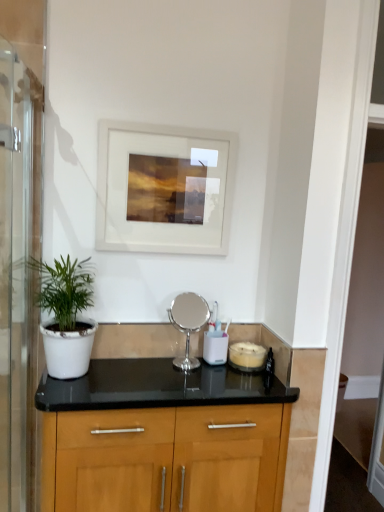
In order to face silver metallic mirror at center, positioned as the 2th appliance in right-to-left order, should I rotate leftwards or rightwards?

Rotate your view left by about 0.871°.

Measure the distance between silver metallic mirror at center, which is the 1th appliance in left-to-right order, and camera.

silver metallic mirror at center, which is the 1th appliance in left-to-right order, is 5.32 feet from camera.

Where is `white matte picture frame at upper center`? white matte picture frame at upper center is located at coordinates (164, 189).

Is point (243, 360) closer or farther from the camera than point (179, 311)?

Point (243, 360) is closer to the camera than point (179, 311).

Find the location of a particular element. This screenshot has width=384, height=512. appliance on the right side of silver metallic mirror at center, which is the 1th appliance in left-to-right order is located at coordinates pyautogui.click(x=247, y=356).

Considering the sizes of white glossy candle at center, placed as the first appliance when sorted from right to left, and silver metallic mirror at center, which is the 1th appliance in left-to-right order, in the image, is white glossy candle at center, placed as the first appliance when sorted from right to left, taller or shorter than silver metallic mirror at center, which is the 1th appliance in left-to-right order,?

In the image, white glossy candle at center, placed as the first appliance when sorted from right to left, appears to be shorter than silver metallic mirror at center, which is the 1th appliance in left-to-right order.

From the image's perspective, is white glossy candle at center, which is counted as the 2th appliance, starting from the left, above silver metallic mirror at center, which is the 1th appliance in left-to-right order?

Actually, white glossy candle at center, which is counted as the 2th appliance, starting from the left, appears below silver metallic mirror at center, which is the 1th appliance in left-to-right order, in the image.

Does white glossy candle at center, placed as the first appliance when sorted from right to left, come in front of white matte pot at left?

No, white glossy candle at center, placed as the first appliance when sorted from right to left, is further to the viewer.

Would you consider white glossy candle at center, placed as the first appliance when sorted from right to left, to be distant from white matte pot at left?

white glossy candle at center, placed as the first appliance when sorted from right to left, is actually quite close to white matte pot at left.

Between white glossy candle at center, which is counted as the 2th appliance, starting from the left, and white matte pot at left, which one has more height?

Standing taller between the two is white matte pot at left.

Is white glossy candle at center, placed as the first appliance when sorted from right to left, at the right side of white matte pot at left?

Yes, white glossy candle at center, placed as the first appliance when sorted from right to left, is to the right of white matte pot at left.

Is silver metallic mirror at center, positioned as the 2th appliance in right-to-left order, spatially inside white matte pot at left, or outside of it?

silver metallic mirror at center, positioned as the 2th appliance in right-to-left order, is spatially situated outside white matte pot at left.

How many degrees apart are the facing directions of silver metallic mirror at center, which is the 1th appliance in left-to-right order, and white matte pot at left?

1.38 degrees.

Considering their positions, is silver metallic mirror at center, which is the 1th appliance in left-to-right order, located in front of or behind white matte pot at left?

In the image, silver metallic mirror at center, which is the 1th appliance in left-to-right order, appears behind white matte pot at left.

Is silver metallic mirror at center, positioned as the 2th appliance in right-to-left order, completely or partially outside of white glossy candle at center, placed as the first appliance when sorted from right to left?

Indeed, silver metallic mirror at center, positioned as the 2th appliance in right-to-left order, is completely outside white glossy candle at center, placed as the first appliance when sorted from right to left.

Considering the sizes of objects silver metallic mirror at center, positioned as the 2th appliance in right-to-left order, and white glossy candle at center, which is counted as the 2th appliance, starting from the left, in the image provided, who is smaller, silver metallic mirror at center, positioned as the 2th appliance in right-to-left order, or white glossy candle at center, which is counted as the 2th appliance, starting from the left,?

white glossy candle at center, which is counted as the 2th appliance, starting from the left, is smaller.

From the image's perspective, which one is positioned higher, silver metallic mirror at center, which is the 1th appliance in left-to-right order, or white glossy candle at center, which is counted as the 2th appliance, starting from the left?

silver metallic mirror at center, which is the 1th appliance in left-to-right order, appears higher in the image.

Are silver metallic mirror at center, positioned as the 2th appliance in right-to-left order, and white glossy candle at center, placed as the first appliance when sorted from right to left, making contact?

No, silver metallic mirror at center, positioned as the 2th appliance in right-to-left order, is not making contact with white glossy candle at center, placed as the first appliance when sorted from right to left.

Is silver metallic mirror at center, which is the 1th appliance in left-to-right order, shorter than white matte picture frame at upper center?

Correct, silver metallic mirror at center, which is the 1th appliance in left-to-right order, is not as tall as white matte picture frame at upper center.

Considering the sizes of objects silver metallic mirror at center, which is the 1th appliance in left-to-right order, and white matte picture frame at upper center in the image provided, who is thinner, silver metallic mirror at center, which is the 1th appliance in left-to-right order, or white matte picture frame at upper center?

white matte picture frame at upper center.

Is silver metallic mirror at center, which is the 1th appliance in left-to-right order, oriented towards white matte picture frame at upper center?

No, silver metallic mirror at center, which is the 1th appliance in left-to-right order, does not turn towards white matte picture frame at upper center.

Is white glossy candle at center, placed as the first appliance when sorted from right to left, at the right side of white matte picture frame at upper center?

Yes.

Does point (259, 352) lie behind point (132, 249)?

Yes, point (259, 352) is farther from viewer.

Is white glossy candle at center, placed as the first appliance when sorted from right to left, positioned behind white matte picture frame at upper center?

Yes, white glossy candle at center, placed as the first appliance when sorted from right to left, is behind white matte picture frame at upper center.

Could you measure the distance between white matte picture frame at upper center and transparent glass screen door at left?

white matte picture frame at upper center is 18.51 inches from transparent glass screen door at left.

Could you tell me if white matte picture frame at upper center is facing transparent glass screen door at left?

No, white matte picture frame at upper center is not facing towards transparent glass screen door at left.

Which object is further away from the camera, white matte picture frame at upper center or transparent glass screen door at left?

white matte picture frame at upper center is behind.

Does white matte picture frame at upper center have a greater width compared to transparent glass screen door at left?

In fact, white matte picture frame at upper center might be narrower than transparent glass screen door at left.

Find the location of a particular element. The height and width of the screenshot is (512, 384). appliance below the silver metallic mirror at center, positioned as the 2th appliance in right-to-left order (from the image's perspective) is located at coordinates (247, 356).

This screenshot has width=384, height=512. What are the coordinates of `the 2nd appliance counting from the right of the white matte pot at left` in the screenshot? It's located at (247, 356).

Considering their positions, is transparent glass screen door at left positioned further to white matte pot at left than silver metallic mirror at center, which is the 1th appliance in left-to-right order?

silver metallic mirror at center, which is the 1th appliance in left-to-right order, is further to white matte pot at left.

Looking at the image, which one is located closer to transparent glass screen door at left, white matte pot at left or silver metallic mirror at center, which is the 1th appliance in left-to-right order?

The object closer to transparent glass screen door at left is white matte pot at left.

Looking at this image, looking at the image, which one is located closer to white matte picture frame at upper center, white glossy candle at center, placed as the first appliance when sorted from right to left, or silver metallic mirror at center, positioned as the 2th appliance in right-to-left order?

The object closer to white matte picture frame at upper center is silver metallic mirror at center, positioned as the 2th appliance in right-to-left order.

When comparing their distances from transparent glass screen door at left, does white matte pot at left or white glossy candle at center, which is counted as the 2th appliance, starting from the left, seem closer?

white matte pot at left.

Looking at the image, which one is located closer to white matte pot at left, white matte picture frame at upper center or white glossy candle at center, which is counted as the 2th appliance, starting from the left?

white matte picture frame at upper center is positioned closer to the anchor white matte pot at left.

When comparing their distances from white matte picture frame at upper center, does transparent glass screen door at left or silver metallic mirror at center, which is the 1th appliance in left-to-right order, seem further?

transparent glass screen door at left.

From the picture: Looking at the image, which one is located further to white matte pot at left, transparent glass screen door at left or white glossy candle at center, which is counted as the 2th appliance, starting from the left?

white glossy candle at center, which is counted as the 2th appliance, starting from the left, is positioned further to the anchor white matte pot at left.

Considering their positions, is white matte pot at left positioned further to white glossy candle at center, placed as the first appliance when sorted from right to left, than silver metallic mirror at center, which is the 1th appliance in left-to-right order?

Based on the image, white matte pot at left appears to be further to white glossy candle at center, placed as the first appliance when sorted from right to left.

Locate an element on the screen. Image resolution: width=384 pixels, height=512 pixels. picture frame between transparent glass screen door at left and silver metallic mirror at center, positioned as the 2th appliance in right-to-left order, in the front-back direction is located at coordinates click(x=164, y=189).

What are the coordinates of `appliance situated between transparent glass screen door at left and white glossy candle at center, which is counted as the 2th appliance, starting from the left, from left to right` in the screenshot? It's located at (188, 323).

Locate an element on the screen. This screenshot has width=384, height=512. houseplant located between transparent glass screen door at left and white matte picture frame at upper center in the depth direction is located at coordinates (66, 315).

Where is `houseplant between transparent glass screen door at left and white glossy candle at center, which is counted as the 2th appliance, starting from the left`? houseplant between transparent glass screen door at left and white glossy candle at center, which is counted as the 2th appliance, starting from the left is located at coordinates (66, 315).